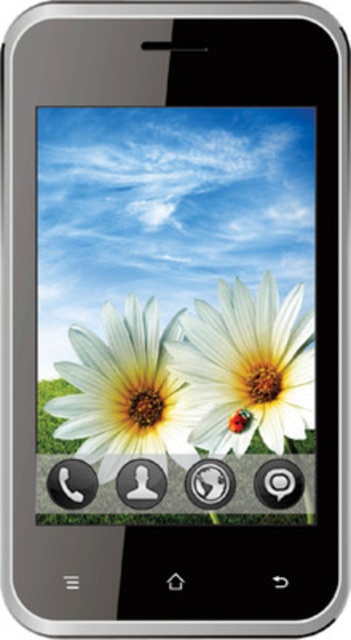
Can you confirm if white matte flower at center is smaller than white matte daisy at center?

Correct, white matte flower at center occupies less space than white matte daisy at center.

Who is taller, white matte flower at center or white matte daisy at center?

Standing taller between the two is white matte flower at center.

Locate an element on the screen. white matte flower at center is located at coordinates (248, 368).